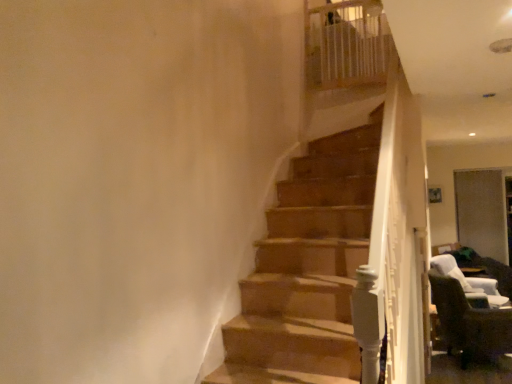
Question: Considering their positions, is white wicker chair at lower right, the 2th chair in the left-to-right sequence, located in front of or behind brown fabric chair at lower right, which is counted as the 2th chair, starting from the right?

Choices:
 (A) behind
 (B) front

Answer: (A)

Question: From the image's perspective, relative to brown fabric chair at lower right, positioned as the first chair in front-to-back order, is white wicker chair at lower right, the 2th chair in the left-to-right sequence, above or below?

Choices:
 (A) below
 (B) above

Answer: (B)

Question: Is white wicker chair at lower right, the second chair positioned from the front, inside the boundaries of brown fabric chair at lower right, which is counted as the 2th chair, starting from the right, or outside?

Choices:
 (A) inside
 (B) outside

Answer: (B)

Question: From a real-world perspective, relative to white wicker chair at lower right, the 2th chair in the left-to-right sequence, is brown fabric chair at lower right, the first chair from the left, vertically above or below?

Choices:
 (A) above
 (B) below

Answer: (B)

Question: Is point (437, 296) positioned closer to the camera than point (440, 256)?

Choices:
 (A) farther
 (B) closer

Answer: (B)

Question: Looking at the image, does brown fabric chair at lower right, the first chair from the left, seem bigger or smaller compared to white wicker chair at lower right, which appears as the 1th chair when viewed from the back?

Choices:
 (A) big
 (B) small

Answer: (A)

Question: Looking at their shapes, would you say brown fabric chair at lower right, the second chair positioned from the back, is wider or thinner than white wicker chair at lower right, which appears as the 1th chair when viewed from the back?

Choices:
 (A) wide
 (B) thin

Answer: (B)